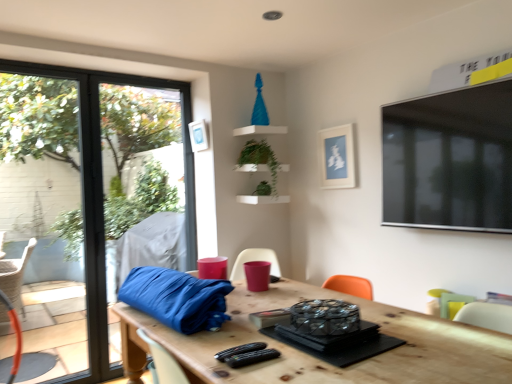
At what (x,y) coordinates should I click in order to perform the action: click on free space in front of matte pink cup at center, which is the 1th armchair in top-to-bottom order. Please return your answer as a coordinate pair (x, y). The height and width of the screenshot is (384, 512). Looking at the image, I should click on (271, 296).